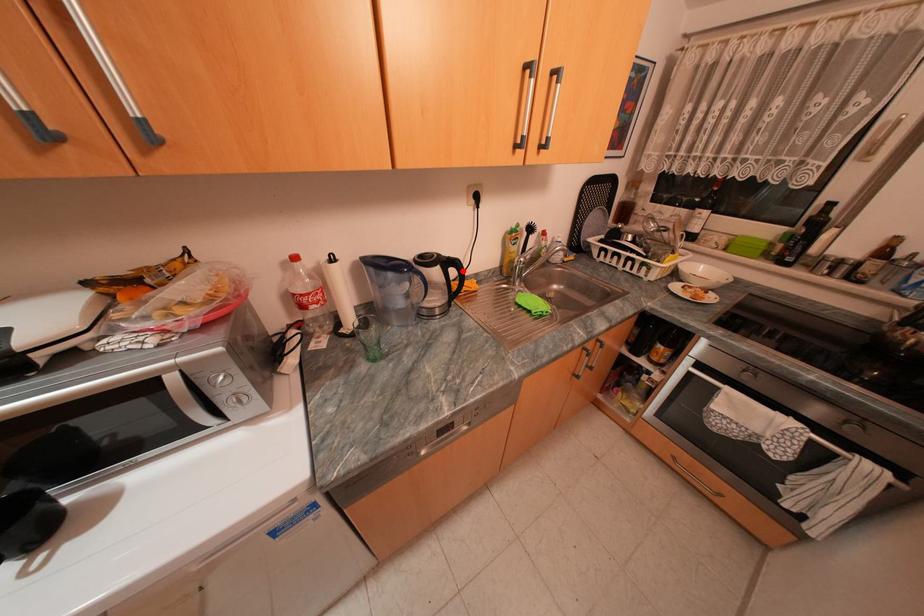
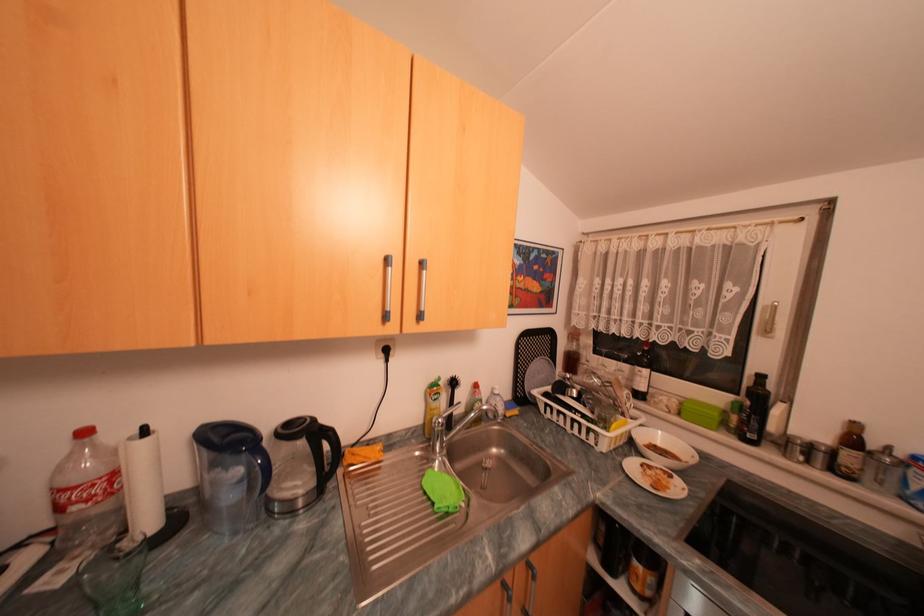
The point at the highlighted location is marked in the first image. Where is the corresponding point in the second image?

(334, 445)